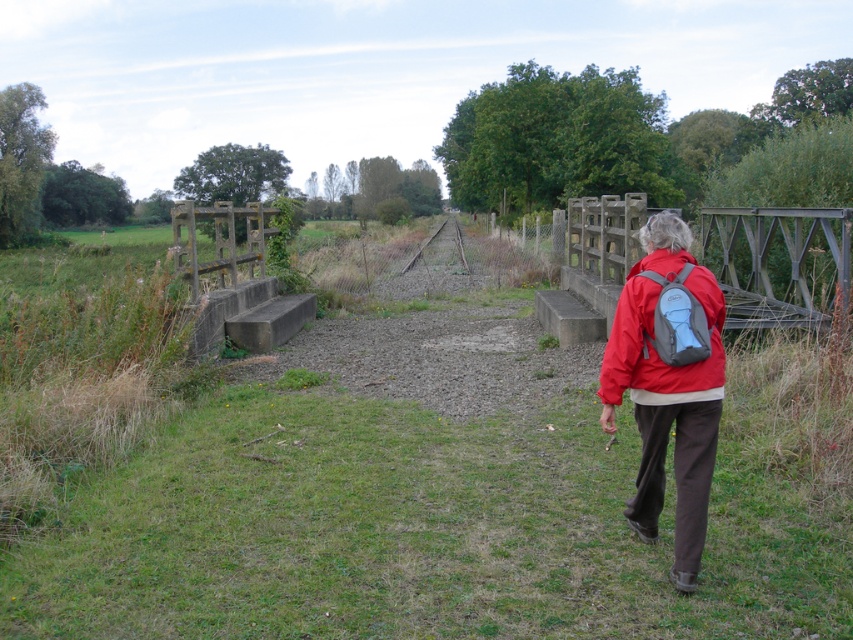
Question: Does red nylon jacket at center appear on the right side of red matte jacket at lower right?

Choices:
 (A) yes
 (B) no

Answer: (B)

Question: Which object appears farthest from the camera in this image?

Choices:
 (A) red matte jacket at lower right
 (B) rusty metal train track at center
 (C) gray fabric backpack at right

Answer: (B)

Question: Is red nylon jacket at center bigger than rusty metal train track at center?

Choices:
 (A) no
 (B) yes

Answer: (A)

Question: Which point appears farthest from the camera in this image?

Choices:
 (A) (685, 348)
 (B) (618, 358)

Answer: (B)

Question: Is gray fabric backpack at right closer to camera compared to rusty metal train track at center?

Choices:
 (A) no
 (B) yes

Answer: (B)

Question: Which of the following is the closest to the observer?

Choices:
 (A) (689, 308)
 (B) (691, 358)

Answer: (B)